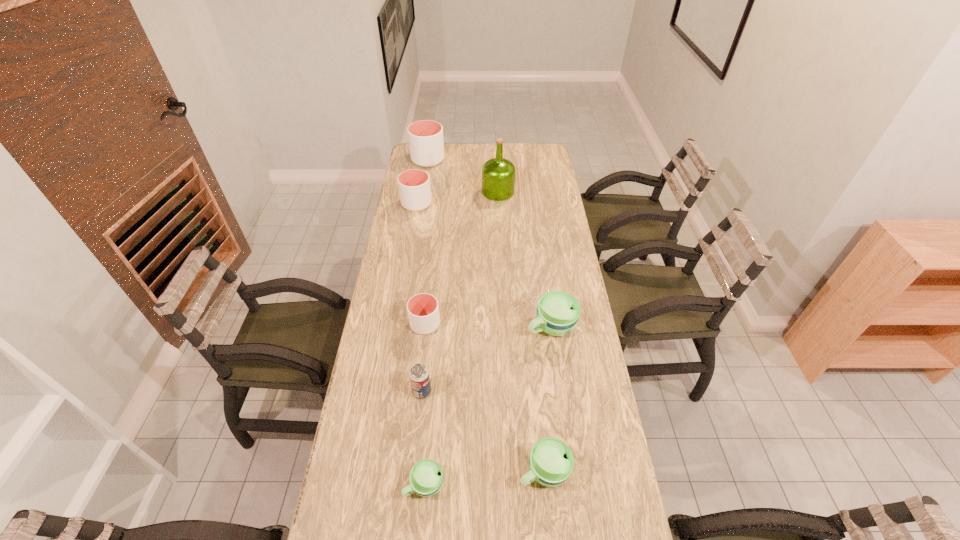
Find the location of `empty space that is in between the second biggest white cup and the shortest cup`. empty space that is in between the second biggest white cup and the shortest cup is located at coordinates (420, 344).

Find the location of a particular element. The width and height of the screenshot is (960, 540). free space between the smallest white cup and the farthest blue cup is located at coordinates (488, 325).

This screenshot has height=540, width=960. In order to click on vacant point located between the smallest white cup and the smallest blue cup in this screenshot , I will do `click(425, 404)`.

The width and height of the screenshot is (960, 540). In order to click on free space between the tallest object and the second farthest cup in this screenshot , I will do `click(457, 198)`.

The width and height of the screenshot is (960, 540). Identify the location of unoccupied position between the second tallest cup and the shortest cup. (420, 344).

Where is `empty location between the farthest blue cup and the tallest cup`? The image size is (960, 540). empty location between the farthest blue cup and the tallest cup is located at coordinates (490, 243).

At what (x,y) coordinates should I click in order to perform the action: click on vacant area that lies between the tallest object and the smallest white cup. Please return your answer as a coordinate pair (x, y). This screenshot has height=540, width=960. Looking at the image, I should click on pyautogui.click(x=462, y=258).

Where is `the fourth closest object to the leftmost blue cup`? Image resolution: width=960 pixels, height=540 pixels. the fourth closest object to the leftmost blue cup is located at coordinates (558, 312).

Locate which object is the seventh closest to the sixth farthest object. Please provide its 2D coordinates. Your answer should be formatted as a tuple, i.e. [(x, y)], where the tuple contains the x and y coordinates of a point satisfying the conditions above.

[(426, 144)]

Where is `cup that is the second closest one to the olive oil`? cup that is the second closest one to the olive oil is located at coordinates (414, 185).